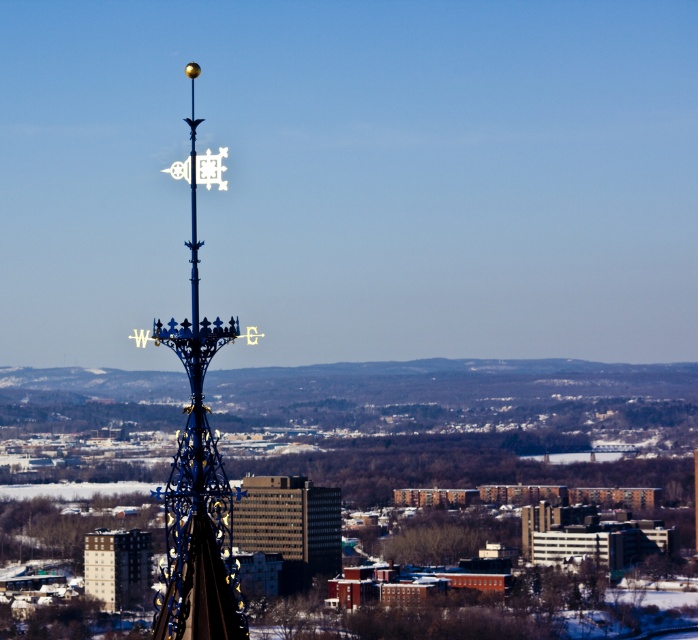
You are standing at the base of the polished metal spire at center and want to reach the top of the brown brick building at center. Which structure will require climbing more steps?

The polished metal spire at center has a greater height compared to the brown brick building at center, so you will need to climb more steps to reach the top of the polished metal spire at center.

You are standing at the observation deck and want to take a photo of the polished metal spire at center and the brown brick building at center. Which object will appear larger in the photo?

The polished metal spire at center will appear larger in the photo because it is closer to the viewer than the brown brick building at center.